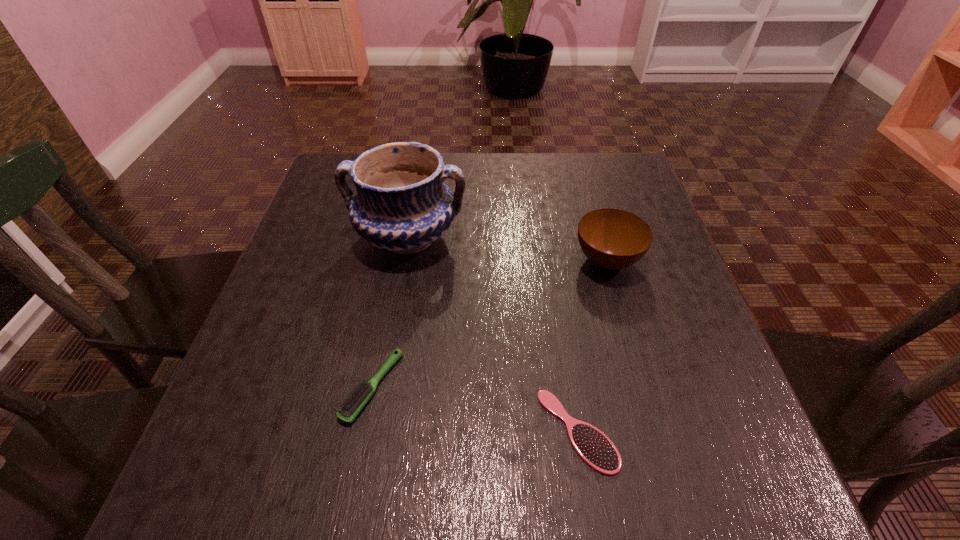
Locate an element on the screen. The image size is (960, 540). pottery is located at coordinates (402, 205).

You are a GUI agent. You are given a task and a screenshot of the screen. Output one action in this format:
    pyautogui.click(x=<x>, y=<y>)
    Task: Click on the third shortest object
    
    Given the screenshot: What is the action you would take?
    pyautogui.click(x=611, y=238)

At what (x,y) coordinates should I click in order to perform the action: click on the second shortest object. Please return your answer as a coordinate pair (x, y). The height and width of the screenshot is (540, 960). Looking at the image, I should click on (355, 401).

The image size is (960, 540). I want to click on the taller hairbrush, so click(355, 401).

The height and width of the screenshot is (540, 960). I want to click on the shorter hairbrush, so click(596, 449).

This screenshot has width=960, height=540. I want to click on the shortest object, so click(x=596, y=449).

I want to click on free region located on the front of the pottery, so click(380, 397).

I want to click on vacant space situated 0.060m on the left of the second tallest object, so click(544, 261).

Locate an element on the screen. vacant position located on the back of the third tallest object is located at coordinates pos(403,227).

The image size is (960, 540). Identify the location of free region located 0.210m on the right of the right hairbrush. (749, 431).